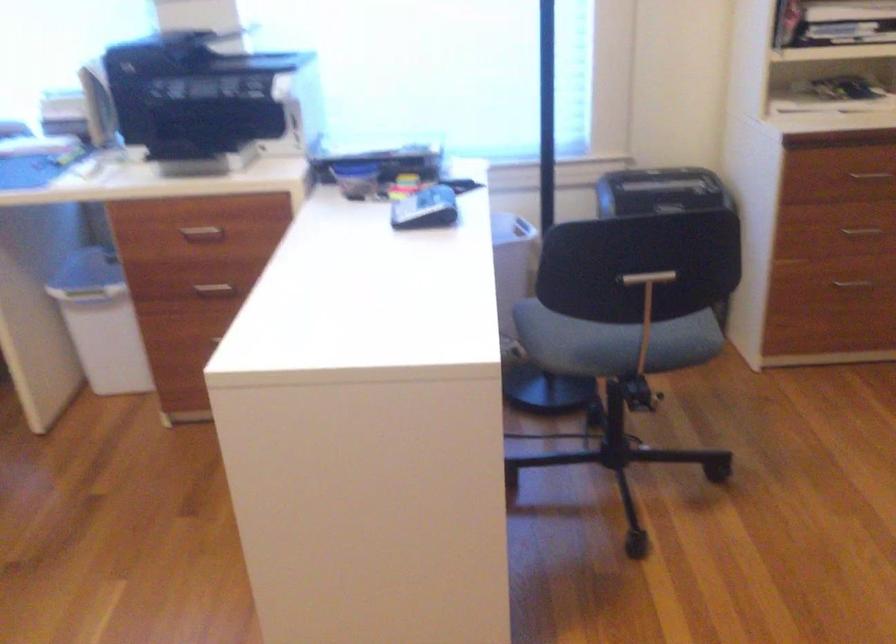
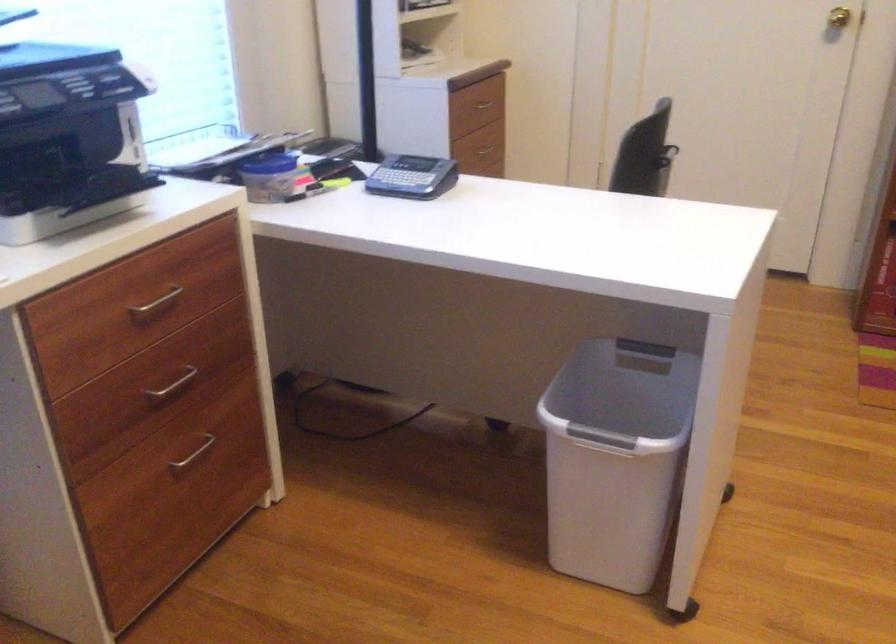
Locate, in the second image, the point that corresponds to the point at 349,163 in the first image.

(270, 164)